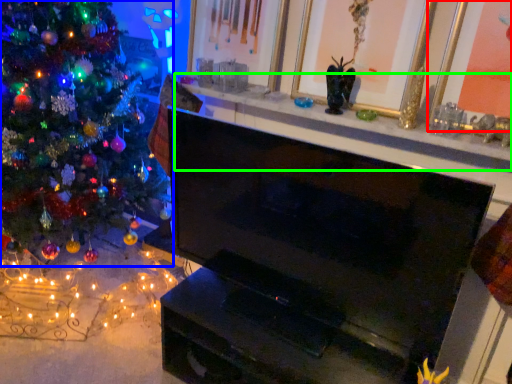
Question: Which object is positioned farthest from picture frame (highlighted by a red box)? Select from christmas tree (highlighted by a blue box) and mantle (highlighted by a green box).

Choices:
 (A) christmas tree
 (B) mantle

Answer: (A)